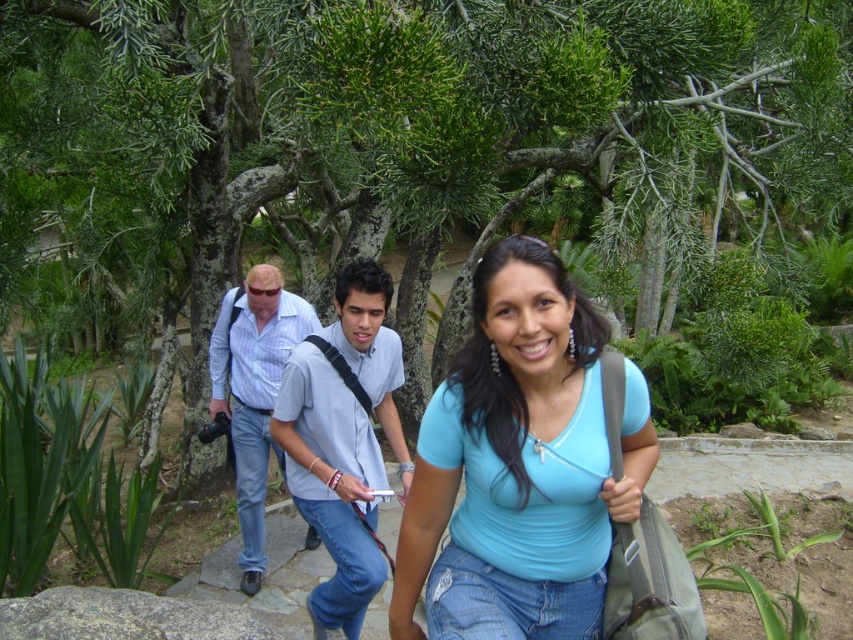
From the picture: You are a photographer trying to capture a clear shot of the blue matte shirt at center and the light blue shirt at center. Which one is closer to the camera?

The blue matte shirt at center is positioned over light blue shirt at center, so the blue matte shirt at center is closer to the camera.

You are a photographer trying to capture a photo of the blue plaid shirt at center and the gray rough rock at lower left. Which object should you focus on first if you want to include both in your frame without moving the camera?

The blue plaid shirt at center is to the left of the gray rough rock at lower left, so you should focus on the blue plaid shirt at center first to ensure both are in the frame without moving the camera.